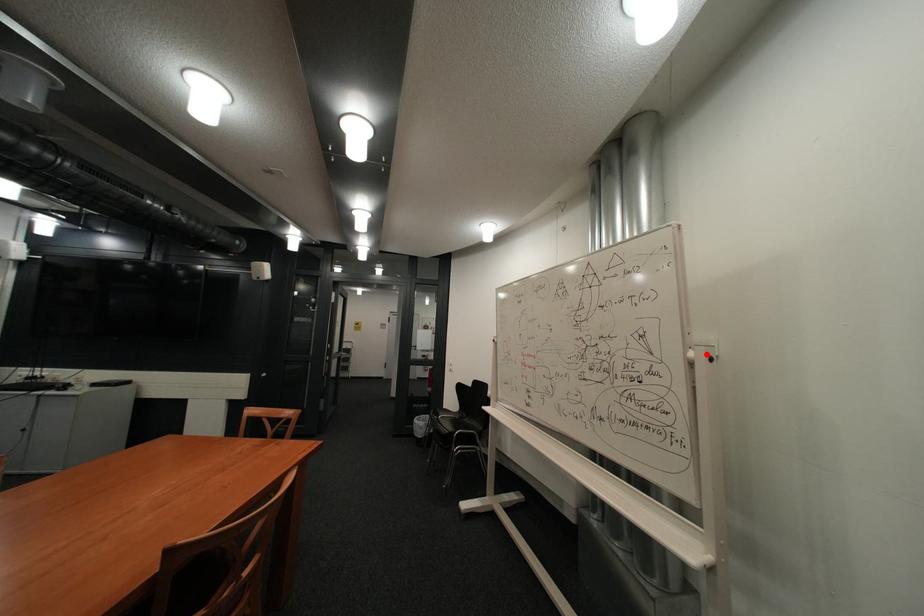
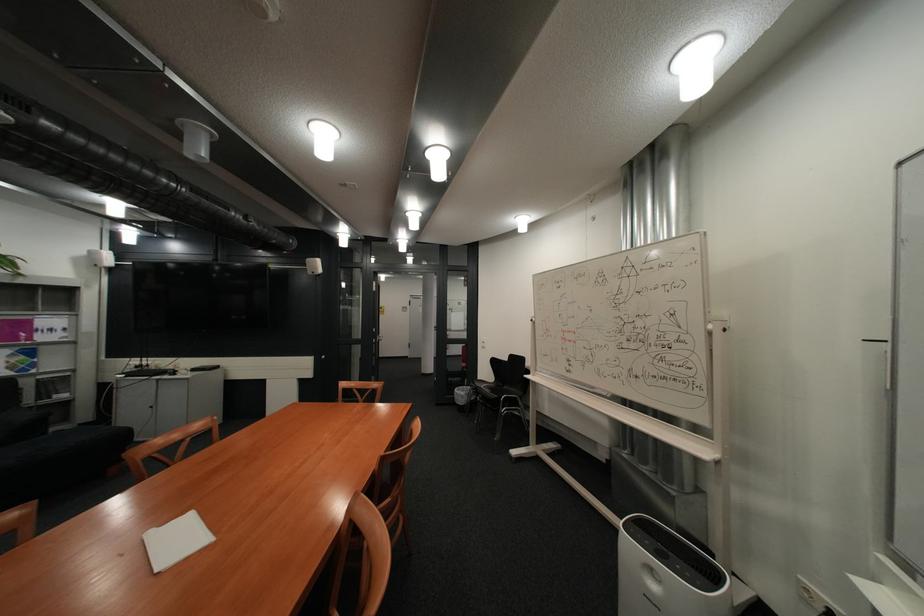
Question: I am providing you with two images of the same scene from different viewpoints. A red point is marked on the first image. At the location where the point appears in image 1, is it still visible in image 2?

Choices:
 (A) Yes
 (B) No

Answer: (A)